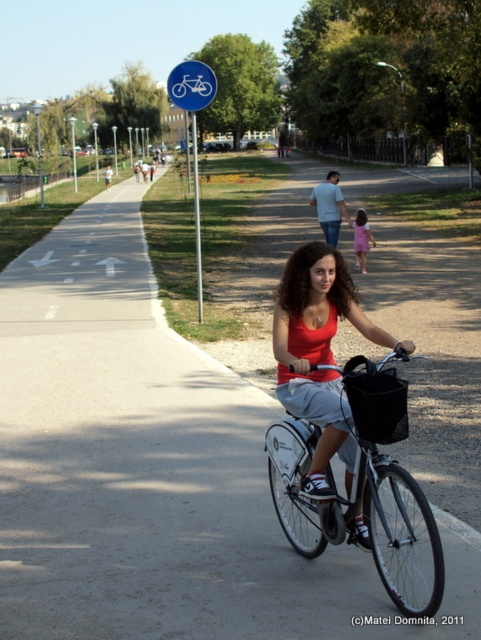
You are a pedestrian standing at the pink fabric dress at center location. You want to cross to the white matte bicycle at center. The path between them is 1.2 meters wide. Can you safely walk across the path without getting too close to the cyclist?

The distance between the white matte bicycle at center and the pink fabric dress at center is 11.88 meters. Since the path is 1.2 meters wide, a pedestrian can safely walk across while maintaining a safe distance from the cyclist.

You are a cyclist on the paved path and you see the point marked at coordinates (329, 205). What object is located at that point?

The point at coordinates (329, 205) indicates light blue jeans at center.